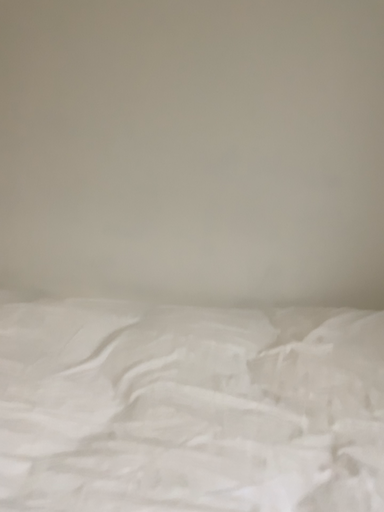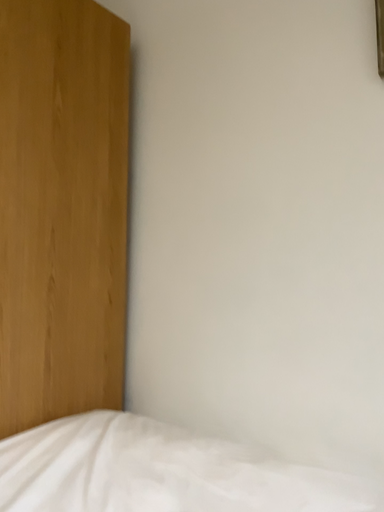
Question: Which way did the camera rotate in the video?

Choices:
 (A) rotated upward
 (B) rotated downward

Answer: (A)